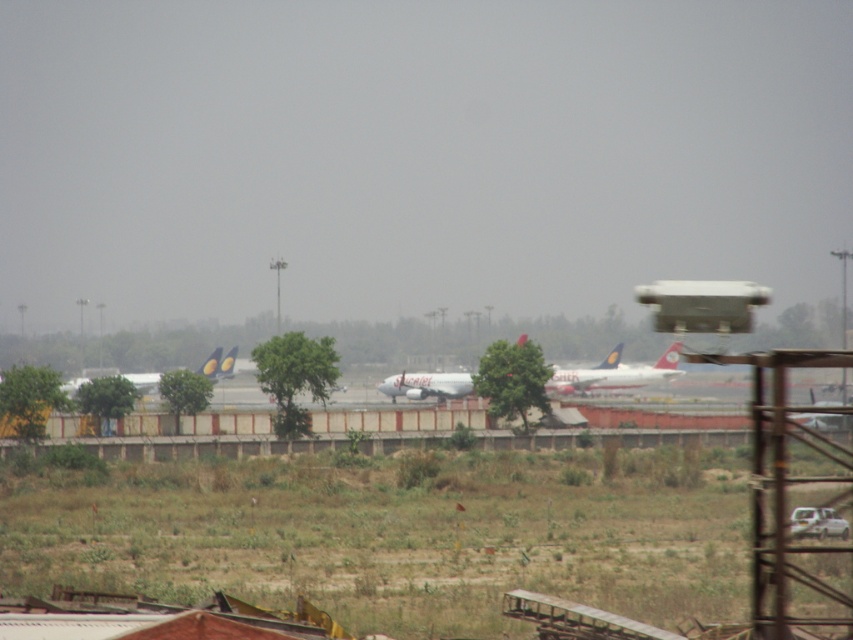
Does point (613, 364) lie behind point (229, 365)?

No, it is not.

Where is `white glossy airplane at center`? The width and height of the screenshot is (853, 640). white glossy airplane at center is located at coordinates (614, 372).